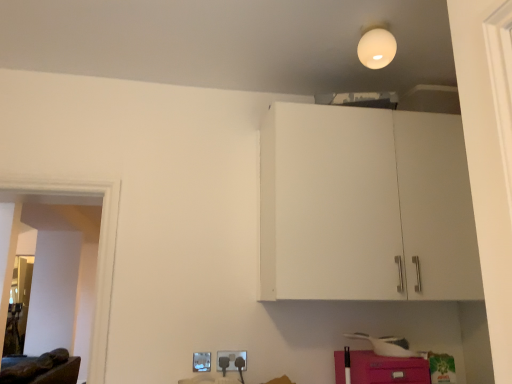
What do you see at coordinates (376, 48) in the screenshot?
I see `white matte light bulb at upper center` at bounding box center [376, 48].

What is the approximate height of brown leather couch at lower left?

brown leather couch at lower left is 19.76 inches tall.

Locate an element on the screen. The height and width of the screenshot is (384, 512). white plastic electric outlet at lower center, the 2th electric outlet positioned from the right is located at coordinates (201, 362).

Locate an element on the screen. The height and width of the screenshot is (384, 512). white matte light bulb at upper center is located at coordinates (376, 48).

Which object is positioned more to the right, matte plastic electric outlet at lower center, which appears as the 1th electric outlet when viewed from the right, or white matte light bulb at upper center?

white matte light bulb at upper center.

Which object is thinner, matte plastic electric outlet at lower center, which is the second electric outlet from left to right, or white matte light bulb at upper center?

With smaller width is matte plastic electric outlet at lower center, which is the second electric outlet from left to right.

Considering the relative sizes of matte plastic electric outlet at lower center, which appears as the 1th electric outlet when viewed from the right, and white matte light bulb at upper center in the image provided, is matte plastic electric outlet at lower center, which appears as the 1th electric outlet when viewed from the right, bigger than white matte light bulb at upper center?

No, matte plastic electric outlet at lower center, which appears as the 1th electric outlet when viewed from the right, is not bigger than white matte light bulb at upper center.

Is white matte light bulb at upper center at the back of matte plastic electric outlet at lower center, which appears as the 1th electric outlet when viewed from the right?

That's not correct — matte plastic electric outlet at lower center, which appears as the 1th electric outlet when viewed from the right, is not looking away from white matte light bulb at upper center.

Is point (52, 372) in front of point (366, 52)?

No.

Which of these two, brown leather couch at lower left or white matte light bulb at upper center, stands shorter?

Standing shorter between the two is white matte light bulb at upper center.

Is brown leather couch at lower left bigger than white matte light bulb at upper center?

Yes, brown leather couch at lower left is bigger than white matte light bulb at upper center.

Is brown leather couch at lower left turned away from white matte light bulb at upper center?

brown leather couch at lower left is not turned away from white matte light bulb at upper center.

From the image's perspective, who appears lower, brown leather couch at lower left or white plastic electric outlet at lower center, the 2th electric outlet positioned from the right?

brown leather couch at lower left, from the image's perspective.

Looking at their sizes, would you say brown leather couch at lower left is wider or thinner than white plastic electric outlet at lower center, the 2th electric outlet positioned from the right?

In the image, brown leather couch at lower left appears to be wider than white plastic electric outlet at lower center, the 2th electric outlet positioned from the right.

Does brown leather couch at lower left have a smaller size compared to white plastic electric outlet at lower center, the 2th electric outlet positioned from the right?

Incorrect, brown leather couch at lower left is not smaller in size than white plastic electric outlet at lower center, the 2th electric outlet positioned from the right.

Which object is positioned more to the right, brown leather couch at lower left or white plastic electric outlet at lower center, the 2th electric outlet positioned from the right?

white plastic electric outlet at lower center, the 2th electric outlet positioned from the right.

Which of these two, white plastic electric outlet at lower center, the 1th electric outlet from the left, or pink matte cabinet at lower right, stands shorter?

white plastic electric outlet at lower center, the 1th electric outlet from the left, is shorter.

Does point (196, 361) appear closer or farther from the camera than point (413, 371)?

Point (196, 361) is positioned farther from the camera compared to point (413, 371).

How distant is white plastic electric outlet at lower center, the 1th electric outlet from the left, from pink matte cabinet at lower right?

They are 30.16 inches apart.

Consider the image. Which of these two, white plastic electric outlet at lower center, the 2th electric outlet positioned from the right, or pink matte cabinet at lower right, is thinner?

white plastic electric outlet at lower center, the 2th electric outlet positioned from the right.

From the image's perspective, would you say white plastic electric outlet at lower center, the 1th electric outlet from the left, is shown under brown leather couch at lower left?

Actually, white plastic electric outlet at lower center, the 1th electric outlet from the left, appears above brown leather couch at lower left in the image.

Is white plastic electric outlet at lower center, the 1th electric outlet from the left, not close to brown leather couch at lower left?

Yes, white plastic electric outlet at lower center, the 1th electric outlet from the left, and brown leather couch at lower left are quite far apart.

Is white plastic electric outlet at lower center, the 2th electric outlet positioned from the right, surrounding brown leather couch at lower left?

No, brown leather couch at lower left is not a part of white plastic electric outlet at lower center, the 2th electric outlet positioned from the right.

Is point (207, 371) farther from camera compared to point (50, 352)?

No, it is in front of (50, 352).

Which is less distant, (x=375, y=61) or (x=397, y=366)?

Point (x=375, y=61) appears to be farther away from the viewer than point (x=397, y=366).

Based on the photo, from the image's perspective, which is above, white matte light bulb at upper center or pink matte cabinet at lower right?

white matte light bulb at upper center, from the image's perspective.

Is white matte light bulb at upper center taller or shorter than pink matte cabinet at lower right?

white matte light bulb at upper center is taller than pink matte cabinet at lower right.

From the image's perspective, is brown leather couch at lower left below matte plastic electric outlet at lower center, which is the second electric outlet from left to right?

Indeed, from the image's perspective, brown leather couch at lower left is shown beneath matte plastic electric outlet at lower center, which is the second electric outlet from left to right.

Is brown leather couch at lower left shorter than matte plastic electric outlet at lower center, which is the second electric outlet from left to right?

Incorrect, the height of brown leather couch at lower left does not fall short of that of matte plastic electric outlet at lower center, which is the second electric outlet from left to right.

From the image's perspective, count 1st electric outlets upward from the brown leather couch at lower left and point to it. Please provide its 2D coordinates.

[(231, 359)]

Is brown leather couch at lower left not inside matte plastic electric outlet at lower center, which appears as the 1th electric outlet when viewed from the right?

Yes, brown leather couch at lower left is not within matte plastic electric outlet at lower center, which appears as the 1th electric outlet when viewed from the right.

You are a GUI agent. You are given a task and a screenshot of the screen. Output one action in this format:
    pyautogui.click(x=<x>, y=<y>)
    Task: Click on the lighting above the matte plastic electric outlet at lower center, which is the second electric outlet from left to right (from a real-world perspective)
    
    Given the screenshot: What is the action you would take?
    pyautogui.click(x=376, y=48)

Where is `lighting that is on the right side of brown leather couch at lower left`? Image resolution: width=512 pixels, height=384 pixels. lighting that is on the right side of brown leather couch at lower left is located at coordinates (376, 48).

Which object lies further to the anchor point white matte light bulb at upper center, pink matte cabinet at lower right or brown leather couch at lower left?

Based on the image, brown leather couch at lower left appears to be further to white matte light bulb at upper center.

Which object lies nearer to the anchor point brown leather couch at lower left, white plastic electric outlet at lower center, the 2th electric outlet positioned from the right, or matte plastic electric outlet at lower center, which appears as the 1th electric outlet when viewed from the right?

white plastic electric outlet at lower center, the 2th electric outlet positioned from the right, lies closer to brown leather couch at lower left than the other object.

From the image, which object appears to be nearer to brown leather couch at lower left, white matte light bulb at upper center or white plastic electric outlet at lower center, the 2th electric outlet positioned from the right?

white plastic electric outlet at lower center, the 2th electric outlet positioned from the right, lies closer to brown leather couch at lower left than the other object.

Considering their positions, is white matte light bulb at upper center positioned closer to brown leather couch at lower left than pink matte cabinet at lower right?

pink matte cabinet at lower right is positioned closer to the anchor brown leather couch at lower left.

Which object lies nearer to the anchor point white matte light bulb at upper center, white plastic electric outlet at lower center, the 2th electric outlet positioned from the right, or matte plastic electric outlet at lower center, which is the second electric outlet from left to right?

matte plastic electric outlet at lower center, which is the second electric outlet from left to right.

When comparing their distances from pink matte cabinet at lower right, does white plastic electric outlet at lower center, the 2th electric outlet positioned from the right, or white matte light bulb at upper center seem closer?

white plastic electric outlet at lower center, the 2th electric outlet positioned from the right.

Which object lies further to the anchor point white plastic electric outlet at lower center, the 2th electric outlet positioned from the right, brown leather couch at lower left or white matte light bulb at upper center?

The object further to white plastic electric outlet at lower center, the 2th electric outlet positioned from the right, is brown leather couch at lower left.

From the image, which object appears to be farther from pink matte cabinet at lower right, white plastic electric outlet at lower center, the 1th electric outlet from the left, or brown leather couch at lower left?

brown leather couch at lower left.

Identify the location of electric outlet between brown leather couch at lower left and matte plastic electric outlet at lower center, which appears as the 1th electric outlet when viewed from the right, in the horizontal direction. (201, 362).

This screenshot has height=384, width=512. Find the location of `electric outlet between white matte light bulb at upper center and matte plastic electric outlet at lower center, which is the second electric outlet from left to right, vertically`. electric outlet between white matte light bulb at upper center and matte plastic electric outlet at lower center, which is the second electric outlet from left to right, vertically is located at coordinates (201, 362).

Where is `cabinetry between white matte light bulb at upper center and white plastic electric outlet at lower center, the 1th electric outlet from the left, in the vertical direction`? This screenshot has width=512, height=384. cabinetry between white matte light bulb at upper center and white plastic electric outlet at lower center, the 1th electric outlet from the left, in the vertical direction is located at coordinates (387, 369).

Locate an element on the screen. The width and height of the screenshot is (512, 384). lighting between brown leather couch at lower left and pink matte cabinet at lower right from left to right is located at coordinates (376, 48).